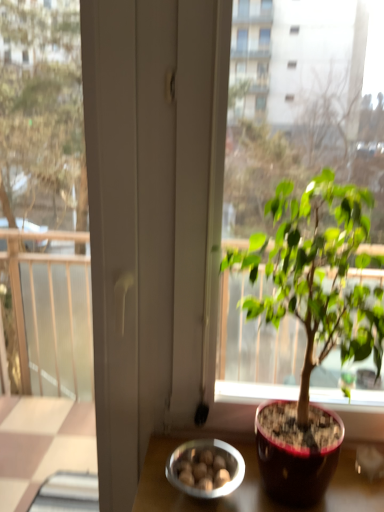
Identify the location of blank space above metallic silver bowl at lower center (from a real-world perspective). The width and height of the screenshot is (384, 512). (217, 462).